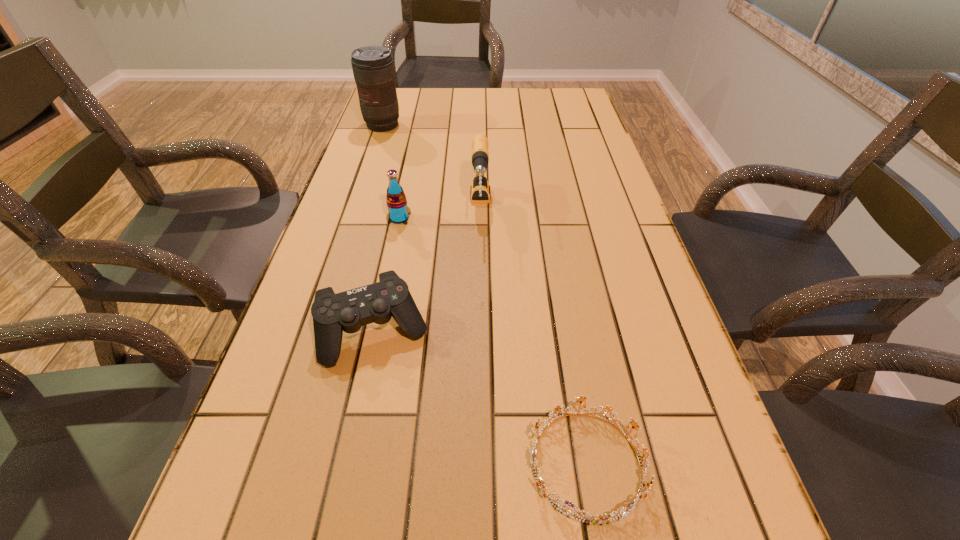
This screenshot has width=960, height=540. I want to click on telephoto lens, so click(373, 68).

Find the location of a particular element. The height and width of the screenshot is (540, 960). the tallest object is located at coordinates (373, 68).

Locate an element on the screen. This screenshot has width=960, height=540. the second object from right to left is located at coordinates click(x=479, y=190).

Locate an element on the screen. This screenshot has height=540, width=960. soda is located at coordinates (396, 201).

The image size is (960, 540). I want to click on the fourth tallest object, so click(x=348, y=311).

The width and height of the screenshot is (960, 540). In order to click on the fourth farthest object in this screenshot , I will do `click(348, 311)`.

Find the location of a particular element. the shortest object is located at coordinates (624, 511).

Identify the location of the rightmost object. point(624,511).

This screenshot has width=960, height=540. I want to click on vacant area situated on the side of the farthest object where the control switches are located, so click(365, 177).

Image resolution: width=960 pixels, height=540 pixels. What are the coordinates of `free space located 0.220m on the handle side of the drill` in the screenshot? It's located at (480, 307).